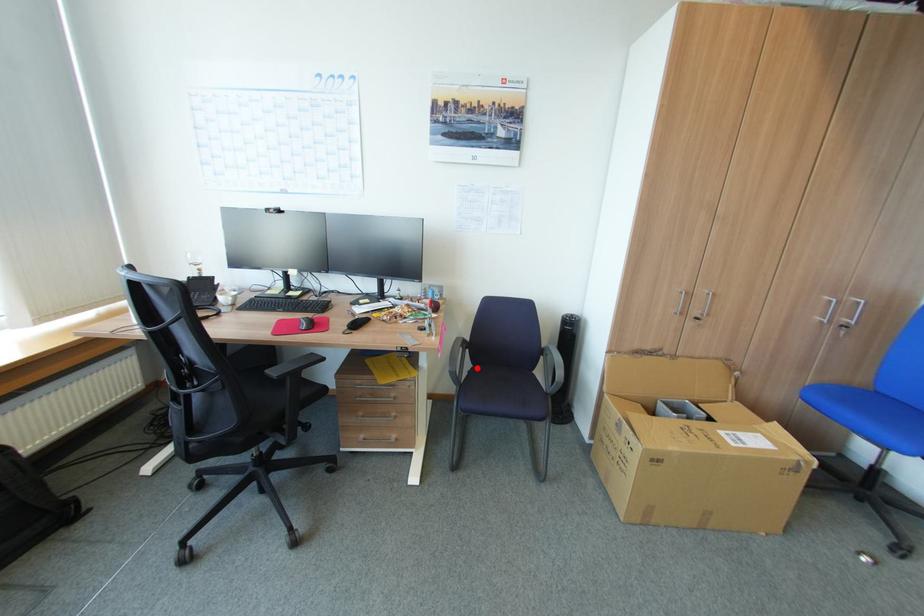
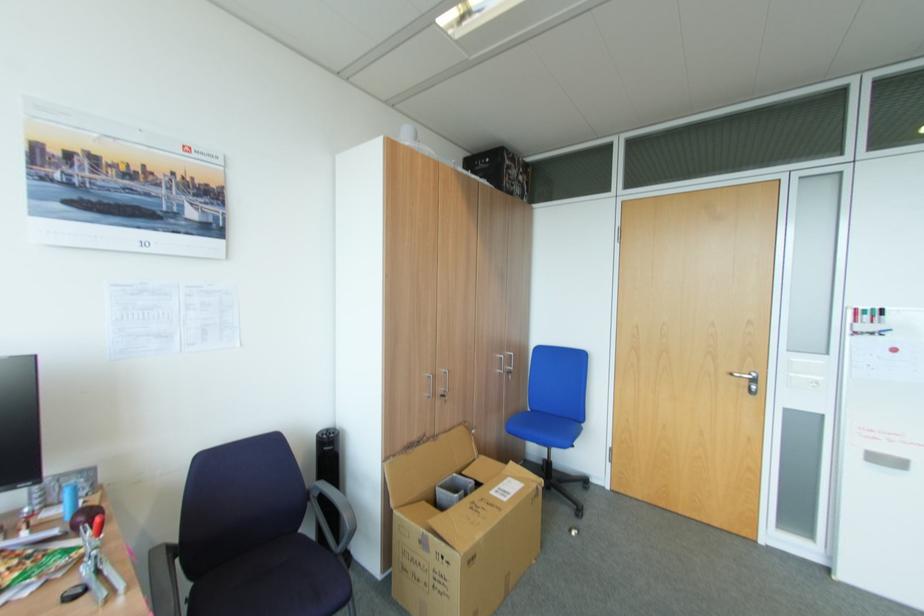
Where in the second image is the point corresponding to the highlighted location from the first image?

(198, 588)